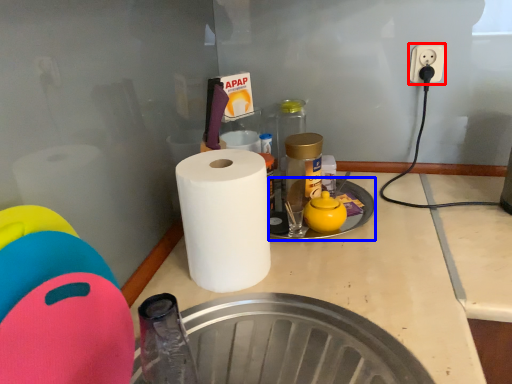
Question: Which object appears closest to the camera in this image, electric outlet (highlighted by a red box) or manhole (highlighted by a blue box)?

Choices:
 (A) electric outlet
 (B) manhole

Answer: (B)